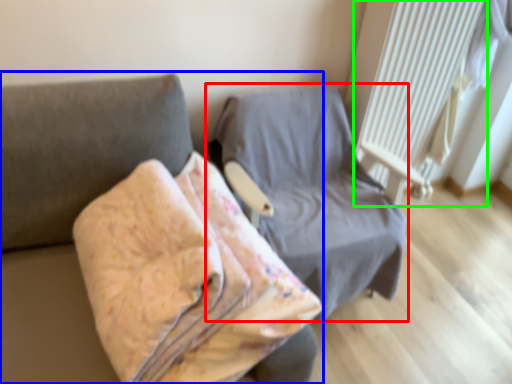
Question: Based on their relative distances, which object is farther from furniture (highlighted by a red box)? Choose from furniture (highlighted by a blue box) and radiator (highlighted by a green box).

Choices:
 (A) furniture
 (B) radiator

Answer: (A)